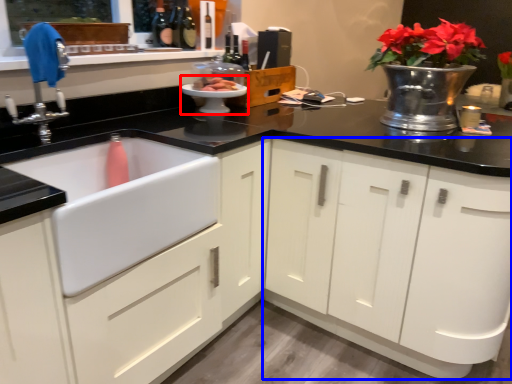
Question: Which point is closer to the camera, appliance (highlighted by a red box) or cabinetry (highlighted by a blue box)?

Choices:
 (A) appliance
 (B) cabinetry

Answer: (B)